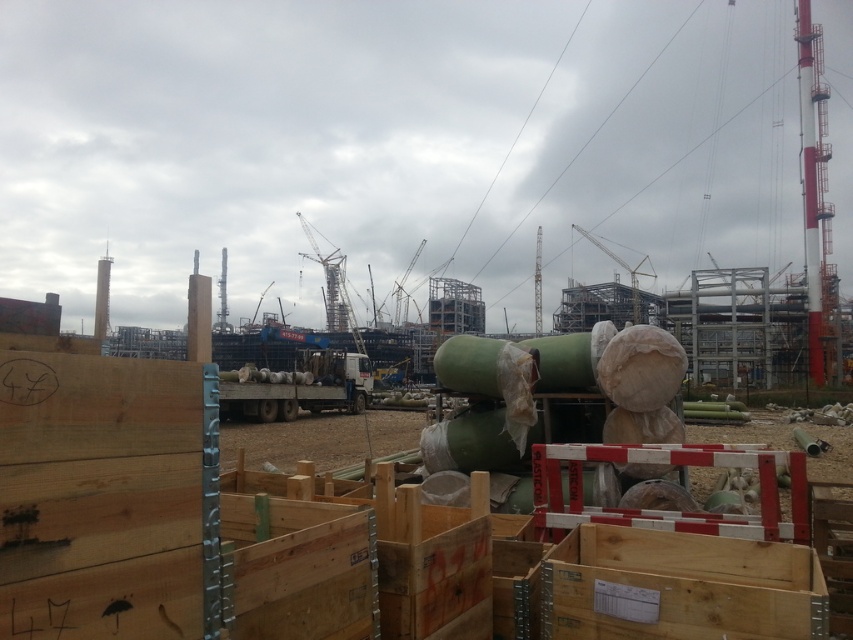
Question: Among these objects, which one is farthest from the camera?

Choices:
 (A) metallic gray crane at center
 (B) white matte trailer truck at center

Answer: (A)

Question: Can you confirm if white matte trailer truck at center is positioned above metallic gray crane at center?

Choices:
 (A) yes
 (B) no

Answer: (B)

Question: Does white matte trailer truck at center have a larger size compared to metallic gray crane at center?

Choices:
 (A) no
 (B) yes

Answer: (A)

Question: Among these objects, which one is nearest to the camera?

Choices:
 (A) white matte trailer truck at center
 (B) metallic gray crane at center

Answer: (A)

Question: Is white matte trailer truck at center further to the viewer compared to metallic gray crane at center?

Choices:
 (A) no
 (B) yes

Answer: (A)